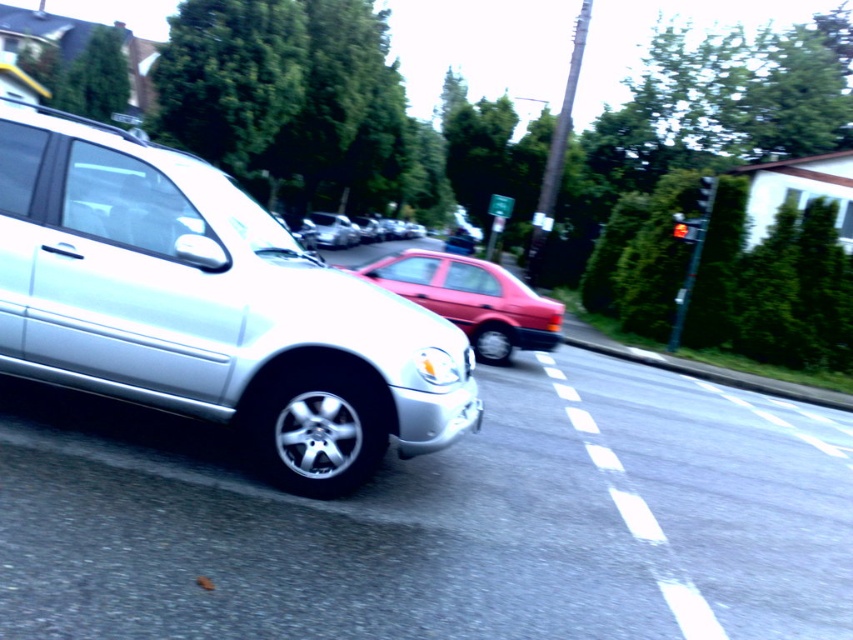
Is point (122, 218) behind point (498, 349)?

No, (122, 218) is in front of (498, 349).

Does satin silver minivan at left have a larger size compared to matte red sedan at center?

No.

Which is in front, point (357, 365) or point (453, 289)?

Point (357, 365) is more forward.

The height and width of the screenshot is (640, 853). Find the location of `satin silver minivan at left`. satin silver minivan at left is located at coordinates (210, 308).

Between satin silver minivan at left and shiny silver sedan at center, which one is positioned lower?

satin silver minivan at left is lower down.

Who is more forward, (x=12, y=182) or (x=347, y=224)?

Positioned in front is point (x=12, y=182).

Image resolution: width=853 pixels, height=640 pixels. What are the coordinates of `satin silver minivan at left` in the screenshot? It's located at (210, 308).

Is point (511, 316) closer to camera compared to point (325, 236)?

Yes, point (511, 316) is closer to viewer.

In the scene shown: Who is more distant from viewer, (482, 268) or (339, 216)?

Point (339, 216)

Identify the location of matte red sedan at center. (473, 300).